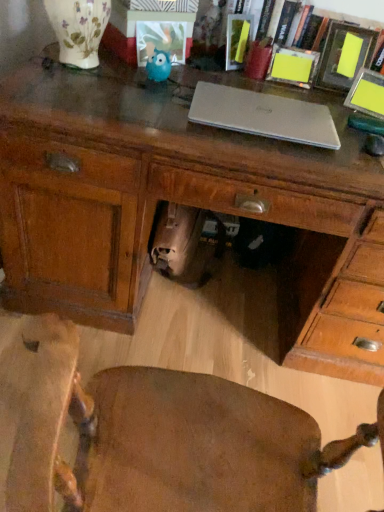
I want to click on free space in front of silver metallic laptop at center, so click(x=259, y=153).